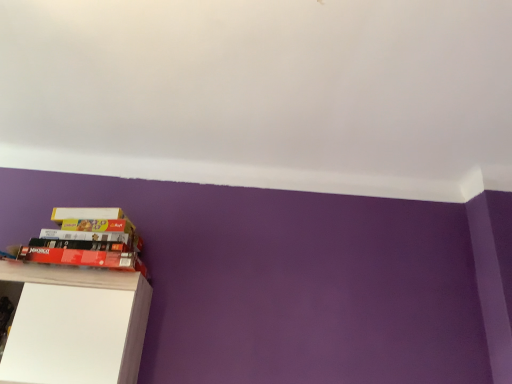
Question: Is white matte book at upper left, acting as the 2th paperback book starting from the bottom, wider or thinner than red matte paperback book at lower left, which is counted as the second paperback book, starting from the top?

Choices:
 (A) thin
 (B) wide

Answer: (A)

Question: Considering the positions of point (70, 216) and point (136, 254), is point (70, 216) closer or farther from the camera than point (136, 254)?

Choices:
 (A) farther
 (B) closer

Answer: (B)

Question: Which object is positioned closest to the white matte book at upper left, acting as the 2th paperback book starting from the bottom?

Choices:
 (A) white matte cabinet at lower left
 (B) red matte paperback book at lower left, which is counted as the second paperback book, starting from the top

Answer: (B)

Question: Which of these objects is positioned farthest from the white matte cabinet at lower left?

Choices:
 (A) white matte book at upper left, the first paperback book viewed from the top
 (B) red matte paperback book at lower left, which is the first paperback book in bottom-to-top order

Answer: (A)